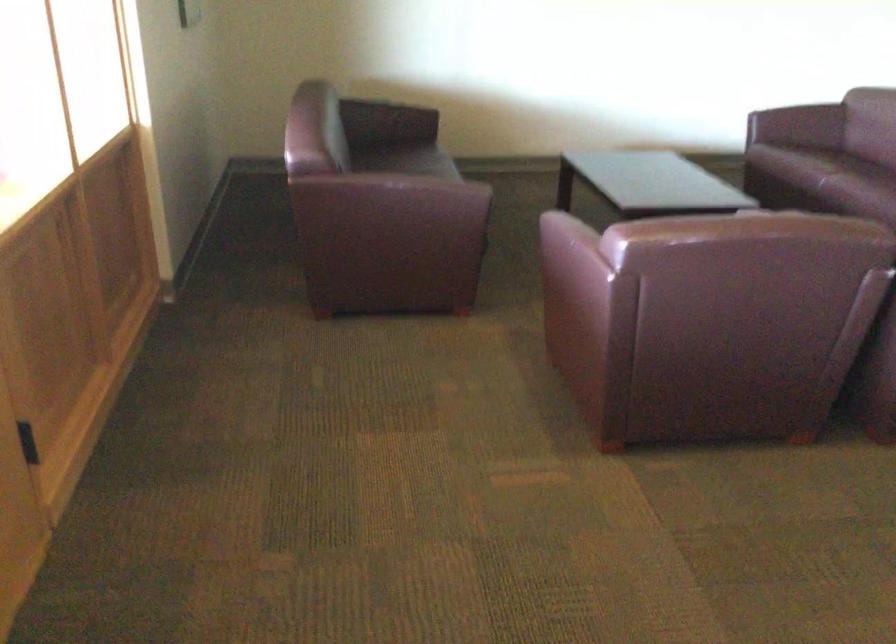
The width and height of the screenshot is (896, 644). Describe the element at coordinates (823, 169) in the screenshot. I see `the sofa surface` at that location.